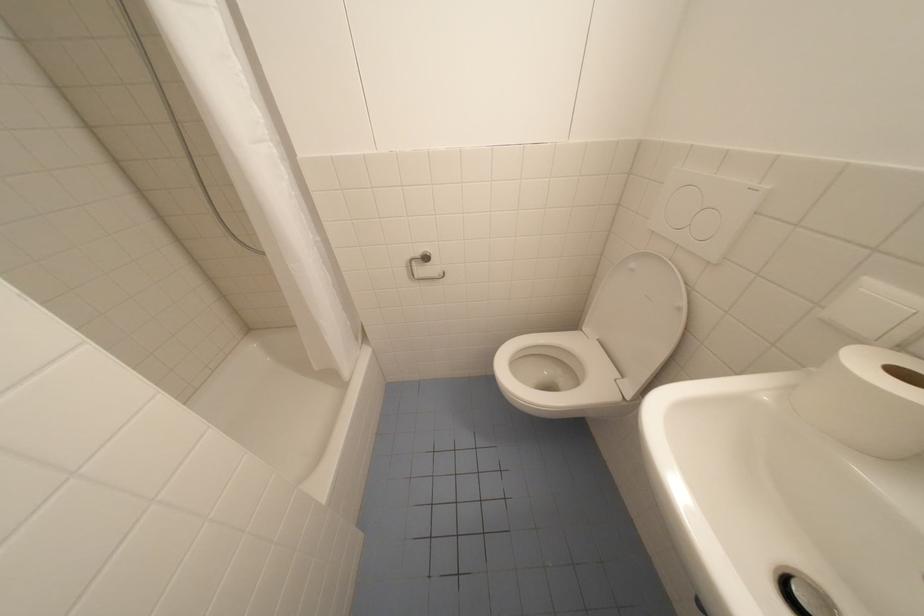
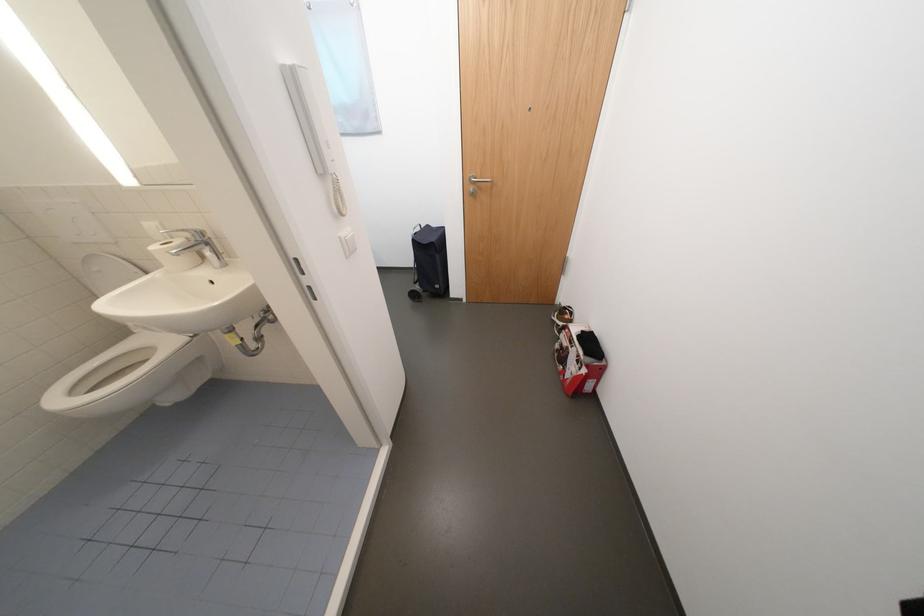
Locate, in the second image, the point that corresponds to point 591,330 in the first image.

(142, 333)